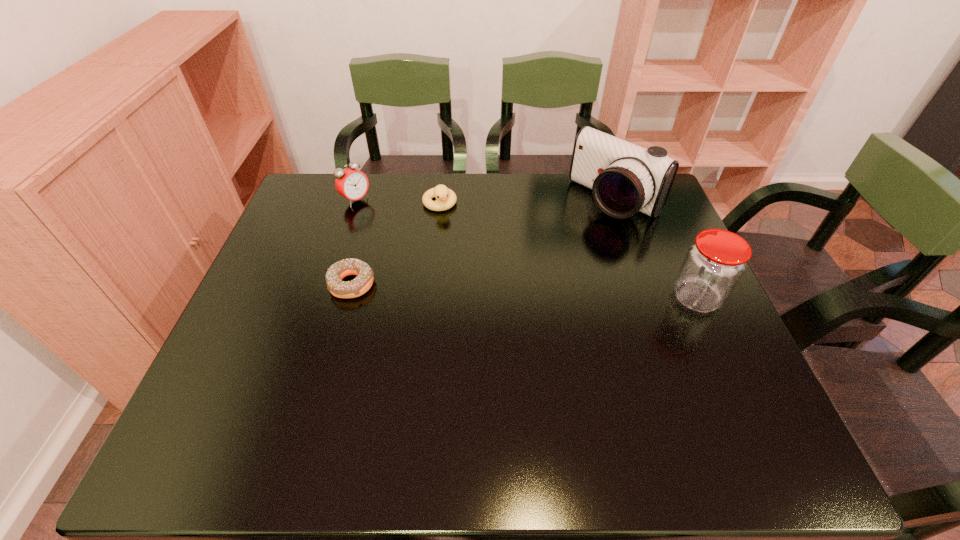
Locate an element on the screen. The image size is (960, 540). vacant space positioned on the front-facing side of the third shortest object is located at coordinates (377, 214).

Locate an element on the screen. The height and width of the screenshot is (540, 960). free location located 0.380m on the surface of the camcorder is located at coordinates (508, 295).

Where is `vacant position located 0.100m on the surface of the camcorder`? The height and width of the screenshot is (540, 960). vacant position located 0.100m on the surface of the camcorder is located at coordinates (572, 240).

Where is `vacant space positioned on the surface of the camcorder`? The height and width of the screenshot is (540, 960). vacant space positioned on the surface of the camcorder is located at coordinates (521, 284).

Find the location of a particular element. Image resolution: width=960 pixels, height=540 pixels. vacant position located at the beak of the third object from right to left is located at coordinates (473, 285).

Image resolution: width=960 pixels, height=540 pixels. What are the coordinates of `vacant space situated at the beak of the third object from right to left` in the screenshot? It's located at (453, 238).

Locate an element on the screen. vacant space situated 0.270m at the beak of the third object from right to left is located at coordinates 470,277.

At what (x,y) coordinates should I click in order to perform the action: click on alarm clock that is at the far edge. Please return your answer as a coordinate pair (x, y). Image resolution: width=960 pixels, height=540 pixels. Looking at the image, I should click on (353, 184).

I want to click on camcorder positioned at the far edge, so click(625, 178).

Identify the location of duckling present at the far edge. The height and width of the screenshot is (540, 960). (445, 198).